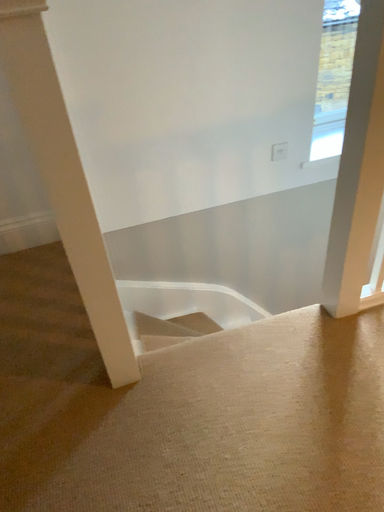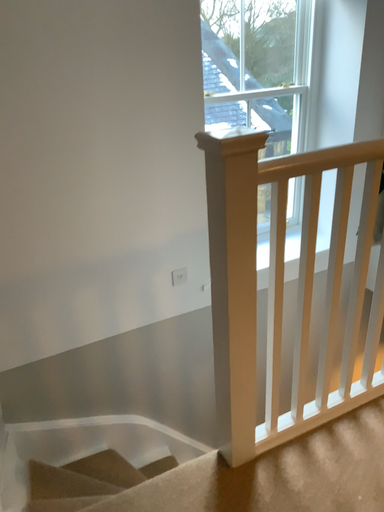
Question: How did the camera likely rotate when shooting the video?

Choices:
 (A) rotated right
 (B) rotated left

Answer: (A)